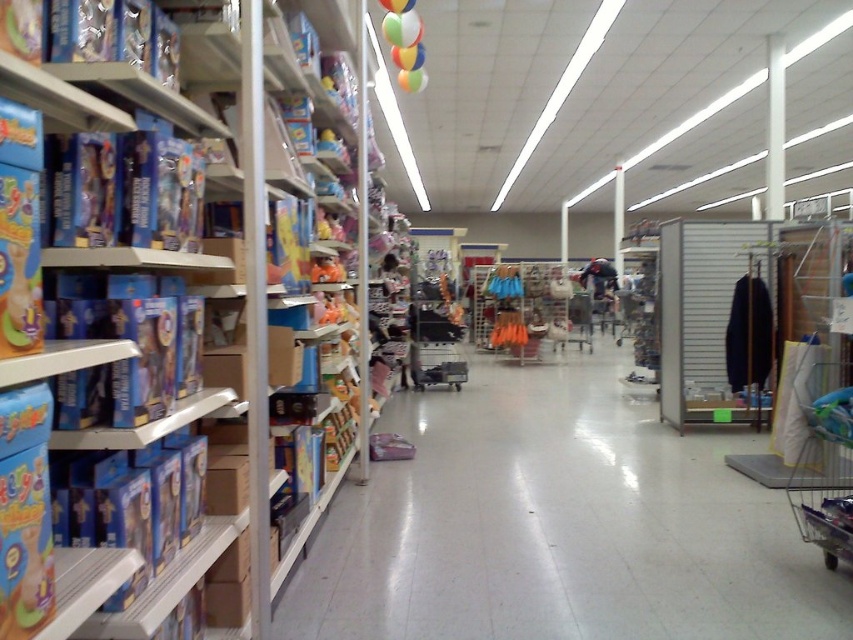
Question: Which object is closer to the camera taking this photo?

Choices:
 (A) blue cardboard boxes at left
 (B) white glossy floor at center
 (C) metallic silver shopping cart at center
 (D) metallic silver shopping cart at lower right

Answer: (A)

Question: Is white glossy floor at center closer to camera compared to blue cardboard boxes at left?

Choices:
 (A) no
 (B) yes

Answer: (A)

Question: Among these objects, which one is farthest from the camera?

Choices:
 (A) metallic silver shopping cart at lower right
 (B) blue cardboard boxes at left

Answer: (A)

Question: Can you confirm if white glossy floor at center is smaller than blue cardboard boxes at left?

Choices:
 (A) no
 (B) yes

Answer: (B)

Question: Among these objects, which one is farthest from the camera?

Choices:
 (A) metallic silver shopping cart at lower right
 (B) white glossy floor at center

Answer: (B)

Question: Is blue cardboard boxes at left to the left of metallic silver shopping cart at lower right from the viewer's perspective?

Choices:
 (A) no
 (B) yes

Answer: (B)